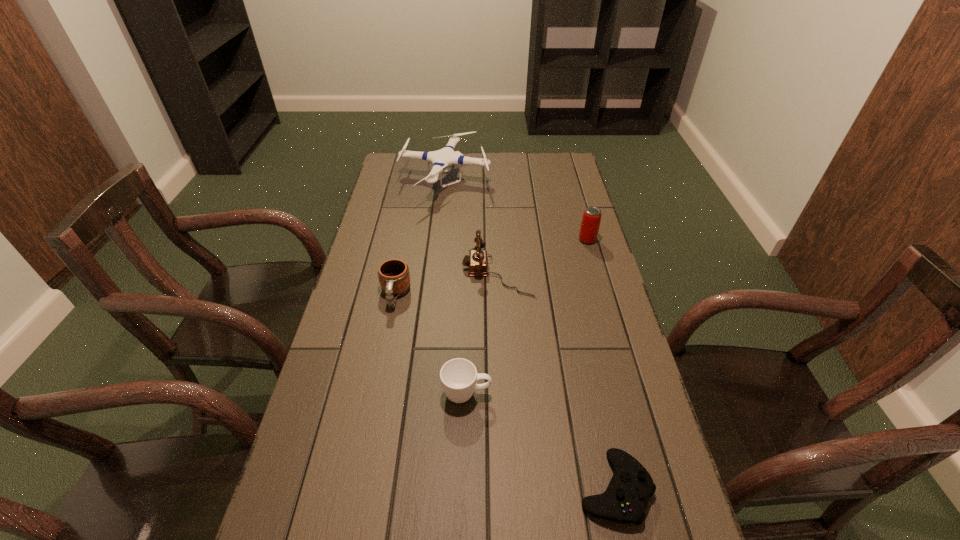
Image resolution: width=960 pixels, height=540 pixels. Identify the location of vacant space that satisfies the following two spatial constraints: 1. on the dial of the shortest object; 2. on the right side of the telephone. (507, 488).